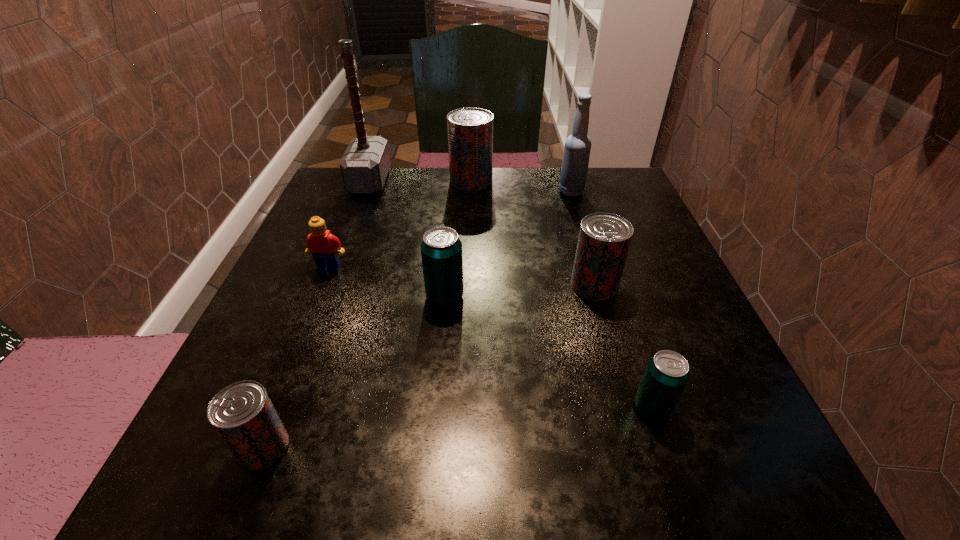
Where is `vacant region that satisfies the following two spatial constraints: 1. on the back side of the bigger teal beer can; 2. on the right side of the second red beer can from left to right`? This screenshot has height=540, width=960. vacant region that satisfies the following two spatial constraints: 1. on the back side of the bigger teal beer can; 2. on the right side of the second red beer can from left to right is located at coordinates 455,181.